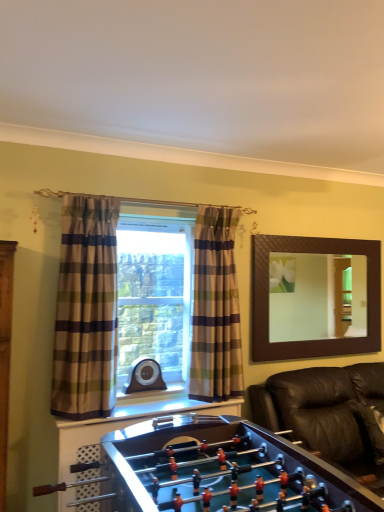
Image resolution: width=384 pixels, height=512 pixels. I want to click on black leather couch at lower right, so click(324, 413).

The width and height of the screenshot is (384, 512). What do you see at coordinates (86, 310) in the screenshot? I see `plaid fabric curtain at left, the 2th curtain in the back-to-front sequence` at bounding box center [86, 310].

Measure the distance between brown textured mirror at upper right and camera.

The depth of brown textured mirror at upper right is 15.66 feet.

What do you see at coordinates (215, 309) in the screenshot? This screenshot has height=512, width=384. I see `plaid fabric curtain at center, which ranks as the 2th curtain in left-to-right order` at bounding box center [215, 309].

The width and height of the screenshot is (384, 512). Identify the location of black leather couch at lower right. (324, 413).

Is shiny brown foosball table at lower center outside of plaid fabric curtain at left, placed as the 1th curtain when sorted from front to back?

Yes, shiny brown foosball table at lower center is located beyond the bounds of plaid fabric curtain at left, placed as the 1th curtain when sorted from front to back.

Which is closer, (177, 474) or (71, 249)?

Clearly, point (177, 474) is closer to the camera than point (71, 249).

Which of these two, shiny brown foosball table at lower center or plaid fabric curtain at left, placed as the 1th curtain when sorted from front to back, stands shorter?

shiny brown foosball table at lower center.

Can you confirm if shiny brown foosball table at lower center is smaller than plaid fabric curtain at left, which is the second curtain from right to left?

No, shiny brown foosball table at lower center is not smaller than plaid fabric curtain at left, which is the second curtain from right to left.

From the image's perspective, does plaid fabric curtain at left, the 2th curtain in the back-to-front sequence, appear higher than plaid fabric curtain at center, which ranks as the 2th curtain in left-to-right order?

Yes, from the image's perspective, plaid fabric curtain at left, the 2th curtain in the back-to-front sequence, is on top of plaid fabric curtain at center, which ranks as the 2th curtain in left-to-right order.

From their relative heights in the image, would you say plaid fabric curtain at left, which is the second curtain from right to left, is taller or shorter than plaid fabric curtain at center, the 1th curtain viewed from the back?

Considering their sizes, plaid fabric curtain at left, which is the second curtain from right to left, has more height than plaid fabric curtain at center, the 1th curtain viewed from the back.

Is plaid fabric curtain at left, placed as the 1th curtain when sorted from front to back, oriented towards plaid fabric curtain at center, the 1th curtain viewed from the back?

No, plaid fabric curtain at left, placed as the 1th curtain when sorted from front to back, does not turn towards plaid fabric curtain at center, the 1th curtain viewed from the back.

Looking at this image, which object is thinner, plaid fabric curtain at left, the 1th curtain viewed from the left, or plaid fabric curtain at center, which ranks as the 2th curtain in left-to-right order?

With smaller width is plaid fabric curtain at center, which ranks as the 2th curtain in left-to-right order.

Measure the distance between brown textured mirror at upper right and black leather couch at lower right.

brown textured mirror at upper right is 7.00 feet away from black leather couch at lower right.

Can you see brown textured mirror at upper right touching black leather couch at lower right?

No.

Locate an element on the screen. studio couch to the right of brown textured mirror at upper right is located at coordinates (324, 413).

Which is more to the left, brown textured mirror at upper right or black leather couch at lower right?

brown textured mirror at upper right is more to the left.

Locate an element on the screen. furniture that appears on the left of plaid fabric curtain at center, which ranks as the 2th curtain in left-to-right order is located at coordinates (221, 470).

In the image, is shiny brown foosball table at lower center on the left side or the right side of plaid fabric curtain at center, the 1th curtain viewed from the back?

shiny brown foosball table at lower center is positioned on plaid fabric curtain at center, the 1th curtain viewed from the back,'s left side.

From a real-world perspective, does shiny brown foosball table at lower center stand above plaid fabric curtain at center, positioned as the 2th curtain in front-to-back order?

Incorrect, from a real-world perspective, shiny brown foosball table at lower center is lower than plaid fabric curtain at center, positioned as the 2th curtain in front-to-back order.

In the scene shown: Is shiny brown foosball table at lower center completely or partially outside of plaid fabric curtain at center, which ranks as the 2th curtain in left-to-right order?

Yes, shiny brown foosball table at lower center is not within plaid fabric curtain at center, which ranks as the 2th curtain in left-to-right order.

In the scene shown: Which is behind, plaid fabric curtain at center, positioned as the 2th curtain in front-to-back order, or shiny brown foosball table at lower center?

plaid fabric curtain at center, positioned as the 2th curtain in front-to-back order.

Is plaid fabric curtain at center, the first curtain from the right, smaller than shiny brown foosball table at lower center?

Correct, plaid fabric curtain at center, the first curtain from the right, occupies less space than shiny brown foosball table at lower center.

Is plaid fabric curtain at center, the first curtain from the right, turned away from shiny brown foosball table at lower center?

No, shiny brown foosball table at lower center is not at the back of plaid fabric curtain at center, the first curtain from the right.

Does shiny brown foosball table at lower center turn towards black leather couch at lower right?

Yes, shiny brown foosball table at lower center is oriented towards black leather couch at lower right.

In the image, is shiny brown foosball table at lower center on the left side or the right side of black leather couch at lower right?

shiny brown foosball table at lower center is positioned on black leather couch at lower right's left side.

Considering the positions of points (140, 455) and (365, 438), is point (140, 455) farther from camera compared to point (365, 438)?

No, it is in front of (365, 438).

Is plaid fabric curtain at center, positioned as the 2th curtain in front-to-back order, aimed at plaid fabric curtain at left, the 2th curtain in the back-to-front sequence?

No, plaid fabric curtain at center, positioned as the 2th curtain in front-to-back order, is not oriented towards plaid fabric curtain at left, the 2th curtain in the back-to-front sequence.

In the scene shown: Between plaid fabric curtain at center, which ranks as the 2th curtain in left-to-right order, and plaid fabric curtain at left, which is the second curtain from right to left, which one has larger size?

With larger size is plaid fabric curtain at left, which is the second curtain from right to left.

From a real-world perspective, is plaid fabric curtain at center, the 1th curtain viewed from the back, physically located above or below plaid fabric curtain at left, which is the second curtain from right to left?

From a real-world perspective, plaid fabric curtain at center, the 1th curtain viewed from the back, is physically below plaid fabric curtain at left, which is the second curtain from right to left.

Measure the distance from plaid fabric curtain at center, positioned as the 2th curtain in front-to-back order, to plaid fabric curtain at left, the 1th curtain viewed from the left.

70.43 centimeters.

There is a shiny brown foosball table at lower center. Where is `the 2nd curtain above it (from the image's perspective)`? the 2nd curtain above it (from the image's perspective) is located at coordinates (86, 310).

Where is `curtain on the left of the plaid fabric curtain at center, the 1th curtain viewed from the back`? curtain on the left of the plaid fabric curtain at center, the 1th curtain viewed from the back is located at coordinates (86, 310).

Looking at the image, which one is located further to shiny brown foosball table at lower center, plaid fabric curtain at center, positioned as the 2th curtain in front-to-back order, or brown textured mirror at upper right?

brown textured mirror at upper right.

Based on their spatial positions, is plaid fabric curtain at center, which ranks as the 2th curtain in left-to-right order, or shiny brown foosball table at lower center further from plaid fabric curtain at left, which is the second curtain from right to left?

shiny brown foosball table at lower center is further to plaid fabric curtain at left, which is the second curtain from right to left.

Considering their positions, is plaid fabric curtain at center, the 1th curtain viewed from the back, positioned further to black leather couch at lower right than plaid fabric curtain at left, which is the second curtain from right to left?

plaid fabric curtain at left, which is the second curtain from right to left.

Estimate the real-world distances between objects in this image. Which object is closer to black leather couch at lower right, brown textured mirror at upper right or plaid fabric curtain at center, positioned as the 2th curtain in front-to-back order?

Based on the image, plaid fabric curtain at center, positioned as the 2th curtain in front-to-back order, appears to be nearer to black leather couch at lower right.

From the image, which object appears to be nearer to plaid fabric curtain at left, the 2th curtain in the back-to-front sequence, plaid fabric curtain at center, the first curtain from the right, or brown textured mirror at upper right?

The object closer to plaid fabric curtain at left, the 2th curtain in the back-to-front sequence, is plaid fabric curtain at center, the first curtain from the right.

Estimate the real-world distances between objects in this image. Which object is closer to brown textured mirror at upper right, black leather couch at lower right or plaid fabric curtain at left, the 2th curtain in the back-to-front sequence?

Among the two, black leather couch at lower right is located nearer to brown textured mirror at upper right.

Looking at the image, which one is located closer to shiny brown foosball table at lower center, brown textured mirror at upper right or plaid fabric curtain at center, which ranks as the 2th curtain in left-to-right order?

plaid fabric curtain at center, which ranks as the 2th curtain in left-to-right order, lies closer to shiny brown foosball table at lower center than the other object.

When comparing their distances from brown textured mirror at upper right, does plaid fabric curtain at left, which is the second curtain from right to left, or black leather couch at lower right seem closer?

black leather couch at lower right.

Locate an element on the screen. Image resolution: width=384 pixels, height=512 pixels. furniture between plaid fabric curtain at left, which is the second curtain from right to left, and black leather couch at lower right from left to right is located at coordinates (221, 470).

You are a GUI agent. You are given a task and a screenshot of the screen. Output one action in this format:
    pyautogui.click(x=<x>, y=<y>)
    Task: Click on the studio couch positioned between shiny brown foosball table at lower center and brown textured mirror at upper right from near to far
    This screenshot has height=512, width=384.
    Given the screenshot: What is the action you would take?
    pyautogui.click(x=324, y=413)

The image size is (384, 512). I want to click on mirror between plaid fabric curtain at left, the 2th curtain in the back-to-front sequence, and black leather couch at lower right, in the horizontal direction, so click(x=316, y=296).

Image resolution: width=384 pixels, height=512 pixels. I want to click on studio couch between shiny brown foosball table at lower center and plaid fabric curtain at center, positioned as the 2th curtain in front-to-back order, in the front-back direction, so click(x=324, y=413).